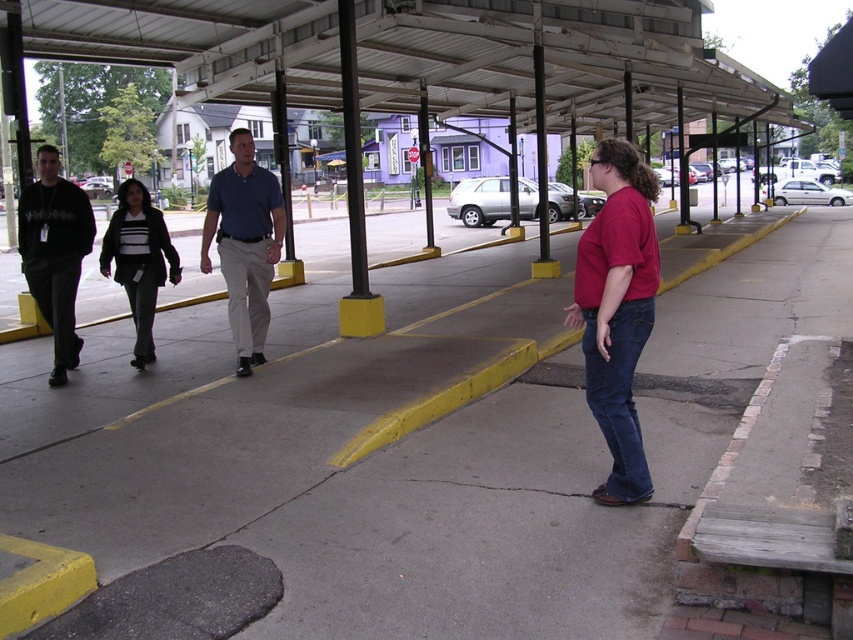
Is matte red shirt at center closer to the viewer compared to yellow painted curb at center?

Yes, it is.

Who is taller, matte red shirt at center or yellow painted curb at center?

With more height is yellow painted curb at center.

Measure the distance between matte red shirt at center and camera.

The distance of matte red shirt at center from camera is 4.07 meters.

At what (x,y) coordinates should I click in order to perform the action: click on matte red shirt at center. Please return your answer as a coordinate pair (x, y). Looking at the image, I should click on (618, 308).

Can you confirm if yellow painted curb at center is positioned to the left of matte black sweater at center?

In fact, yellow painted curb at center is to the right of matte black sweater at center.

Consider the image. Can you confirm if yellow painted curb at center is smaller than matte black sweater at center?

Actually, yellow painted curb at center might be larger than matte black sweater at center.

I want to click on yellow painted curb at center, so click(450, 397).

Identify the location of yellow painted curb at center. (450, 397).

Between gray concrete pavement at center and matte black shirt at left, which one has more height?

Standing taller between the two is gray concrete pavement at center.

Which is above, gray concrete pavement at center or matte black shirt at left?

matte black shirt at left

Is point (817, 209) closer to viewer compared to point (74, 276)?

No, it is not.

You are a GUI agent. You are given a task and a screenshot of the screen. Output one action in this format:
    pyautogui.click(x=<x>, y=<y>)
    Task: Click on the gray concrete pavement at center
    The image size is (853, 640).
    Given the screenshot: What is the action you would take?
    pyautogui.click(x=439, y=465)